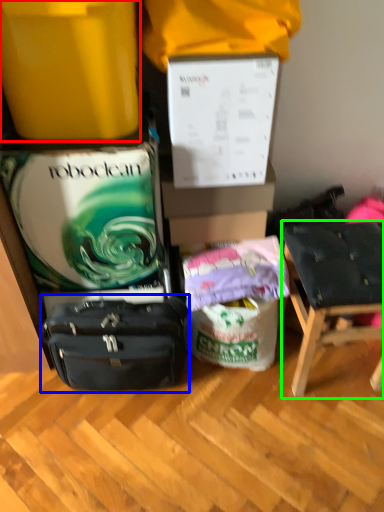
Question: Estimate the real-world distances between objects in this image. Which object is farther from box (highlighted by a red box), luggage and bags (highlighted by a blue box) or chair (highlighted by a green box)?

Choices:
 (A) luggage and bags
 (B) chair

Answer: (B)